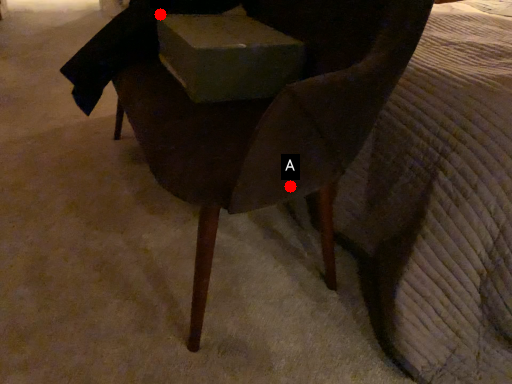
Question: Two points are circled on the image, labeled by A and B beside each circle. Which point appears closest to the camera in this image?

Choices:
 (A) A is closer
 (B) B is closer

Answer: (A)